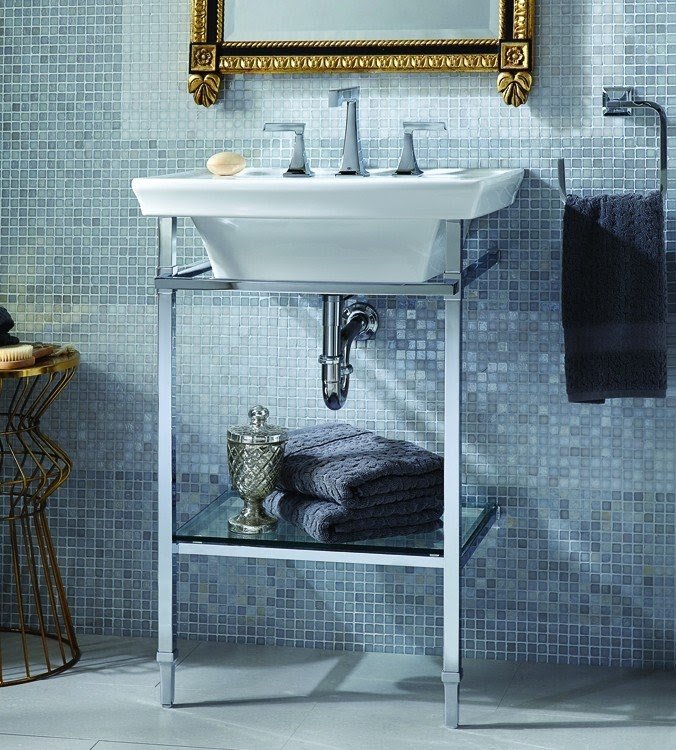
The width and height of the screenshot is (676, 750). Identify the location of table. (17, 374).